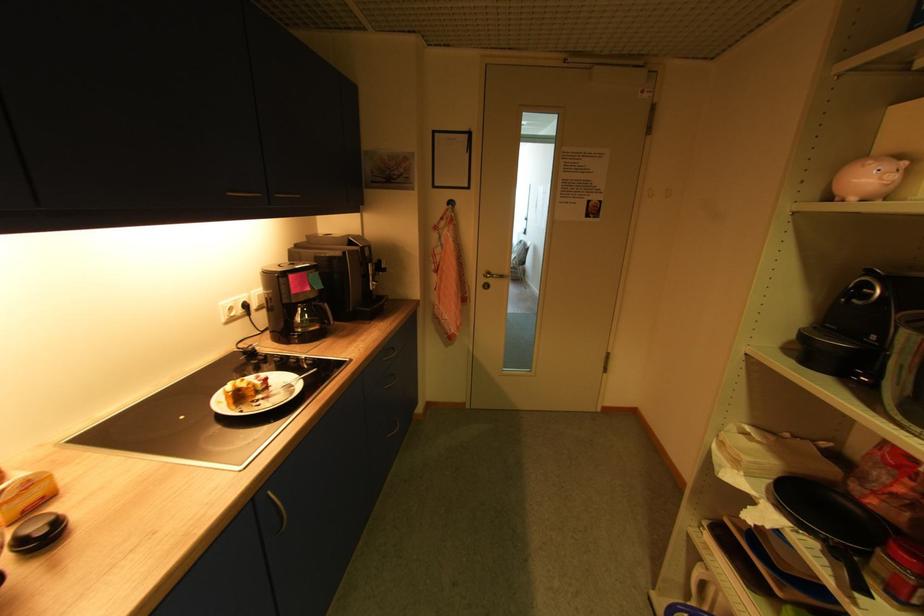
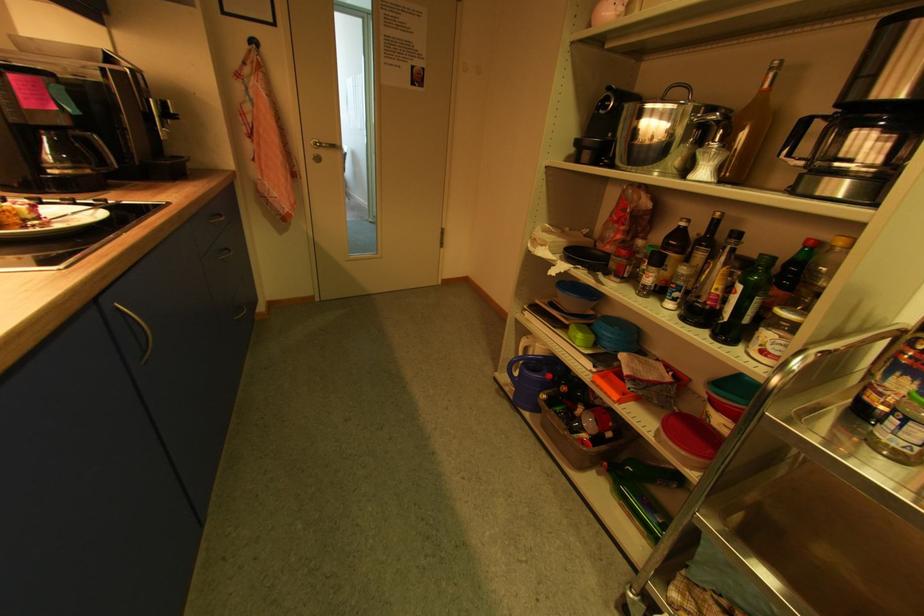
In the second image, find the point that corresponds to point (274, 498) in the first image.

(125, 310)